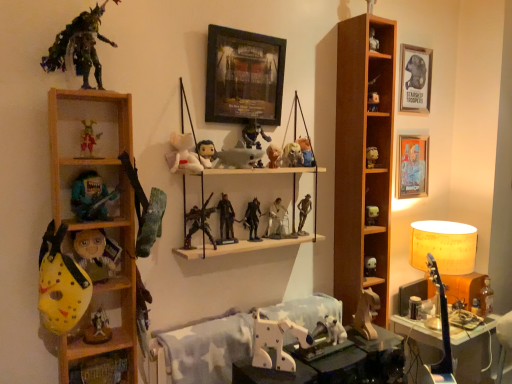
Question: Would you say white matte figurine at upper right, the nineteenth toy ordered from the bottom, is inside or outside white matte figurine at center-right, the ninth toy positioned from the bottom?

Choices:
 (A) inside
 (B) outside

Answer: (B)

Question: Is point (370, 155) positioned closer to the camera than point (377, 213)?

Choices:
 (A) farther
 (B) closer

Answer: (B)

Question: Estimate the real-world distances between objects in this image. Which object is farther from the wooden shelf at left, marked as the first shelf in a front-to-back arrangement?

Choices:
 (A) white matte figurine at upper right, acting as the 6th toy starting from the top
 (B) metallic silver picture frame at right, the second picture frame viewed from the front
 (C) metallic silver figure at center, which is counted as the twelfth toy, starting from the top
 (D) white plastic table at lower center, positioned as the 1th table in left-to-right order
 (E) metallic figure at center, the 8th toy positioned from the bottom

Answer: (B)

Question: Which object is the farthest from the white plush toy at center, marked as the 15th toy in a bottom-to-top arrangement?

Choices:
 (A) white matte figurine at center-right, which appears as the sixteenth toy when viewed from the top
 (B) white plastic walker at center, acting as the 14th toy starting from the top
 (C) orange fabric lampshade at right
 (D) metallic silver figure at center, which is counted as the twelfth toy, starting from the top
 (E) white matte figurine at upper right, acting as the 6th toy starting from the top

Answer: (C)